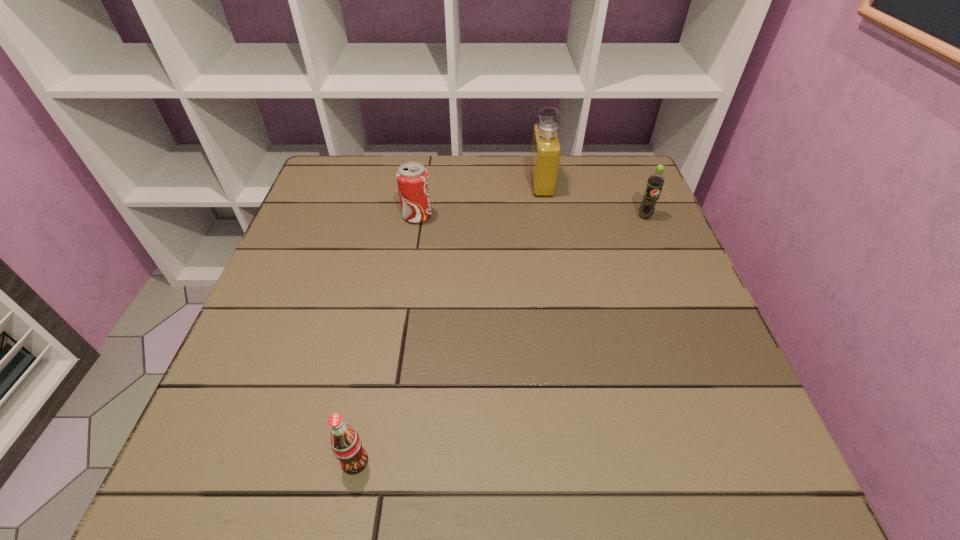
At what (x,y) coordinates should I click in order to perform the action: click on object that is at the near edge. Please return your answer as a coordinate pair (x, y). The height and width of the screenshot is (540, 960). Looking at the image, I should click on (346, 444).

At what (x,y) coordinates should I click in order to perform the action: click on object present at the right edge. Please return your answer as a coordinate pair (x, y). The image size is (960, 540). Looking at the image, I should click on (655, 182).

Locate an element on the screen. Image resolution: width=960 pixels, height=540 pixels. free point at the far edge is located at coordinates (472, 177).

Locate an element on the screen. This screenshot has width=960, height=540. vacant space at the near edge of the desktop is located at coordinates (419, 438).

This screenshot has height=540, width=960. In the image, there is a desktop. In order to click on vacant region at the left edge in this screenshot , I will do `click(305, 269)`.

You are a GUI agent. You are given a task and a screenshot of the screen. Output one action in this format:
    pyautogui.click(x=<x>, y=<y>)
    Task: Click on the free space at the right edge of the desktop
    Image resolution: width=960 pixels, height=540 pixels.
    Given the screenshot: What is the action you would take?
    pyautogui.click(x=629, y=327)

Locate an element on the screen. The height and width of the screenshot is (540, 960). vacant area at the far left corner of the desktop is located at coordinates (359, 170).

Locate an element on the screen. Image resolution: width=960 pixels, height=540 pixels. free location at the far right corner is located at coordinates (586, 165).

Locate an element on the screen. The height and width of the screenshot is (540, 960). free space at the near right corner is located at coordinates (696, 467).

At what (x,y) coordinates should I click in order to perform the action: click on vacant space in between the perfume and the nearest object. Please return your answer as a coordinate pair (x, y). Looking at the image, I should click on (448, 322).